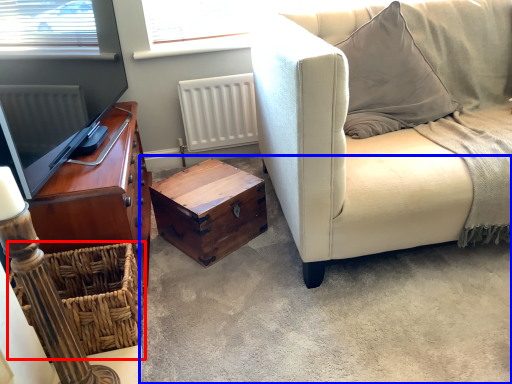
Question: Among these objects, which one is farthest to the camera, crate (highlighted by a red box) or concrete (highlighted by a blue box)?

Choices:
 (A) crate
 (B) concrete

Answer: (A)